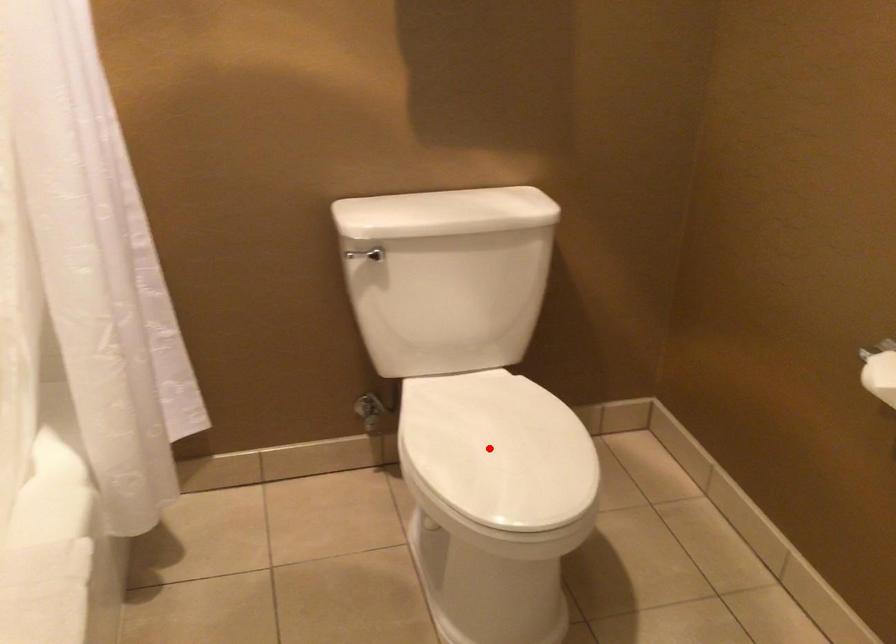
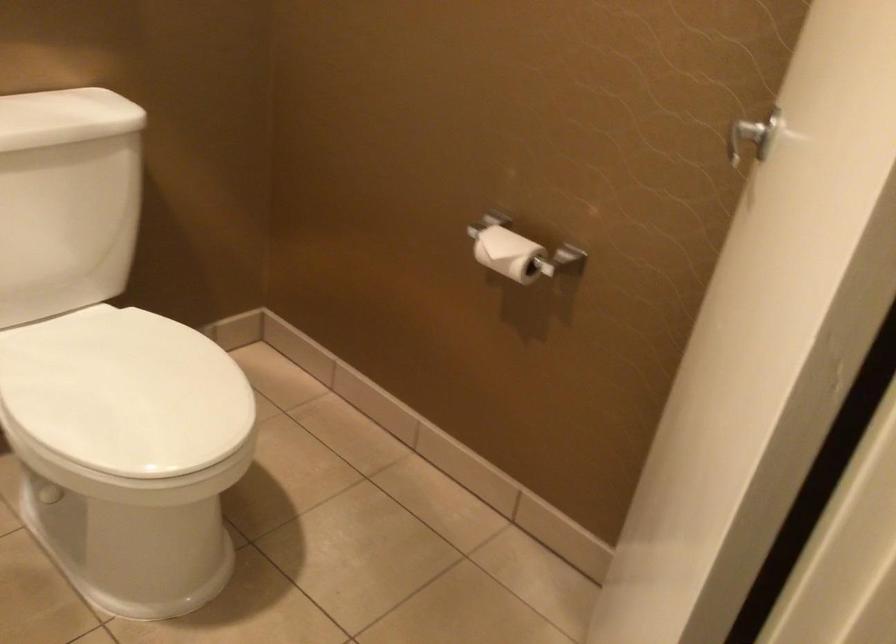
Locate, in the second image, the point that corresponds to the highlighted location in the first image.

(125, 393)